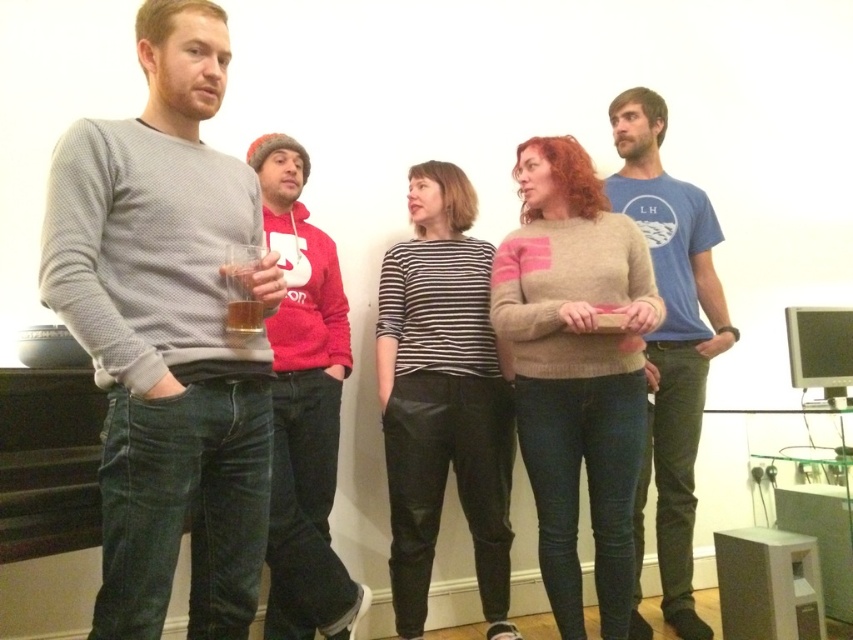
Question: Which point is farther from the camera taking this photo?

Choices:
 (A) (248, 323)
 (B) (434, 442)
 (C) (665, 280)

Answer: (C)

Question: From the image, what is the correct spatial relationship of gray textured sweater at left in relation to translucent glass at left?

Choices:
 (A) below
 (B) above

Answer: (A)

Question: Can you confirm if blue cotton t-shirt at center is smaller than translucent glass cup at left?

Choices:
 (A) yes
 (B) no

Answer: (B)

Question: Which point is closer to the camera?

Choices:
 (A) blue cotton t-shirt at center
 (B) matte red hoodie at center
 (C) gray textured sweater at left

Answer: (C)

Question: Which of the following is the farthest from the observer?

Choices:
 (A) [x=229, y=312]
 (B) [x=318, y=515]
 (C) [x=178, y=10]

Answer: (B)

Question: Considering the relative positions of beige knitted sweater at center and matte red hoodie at center in the image provided, where is beige knitted sweater at center located with respect to matte red hoodie at center?

Choices:
 (A) left
 (B) right

Answer: (B)